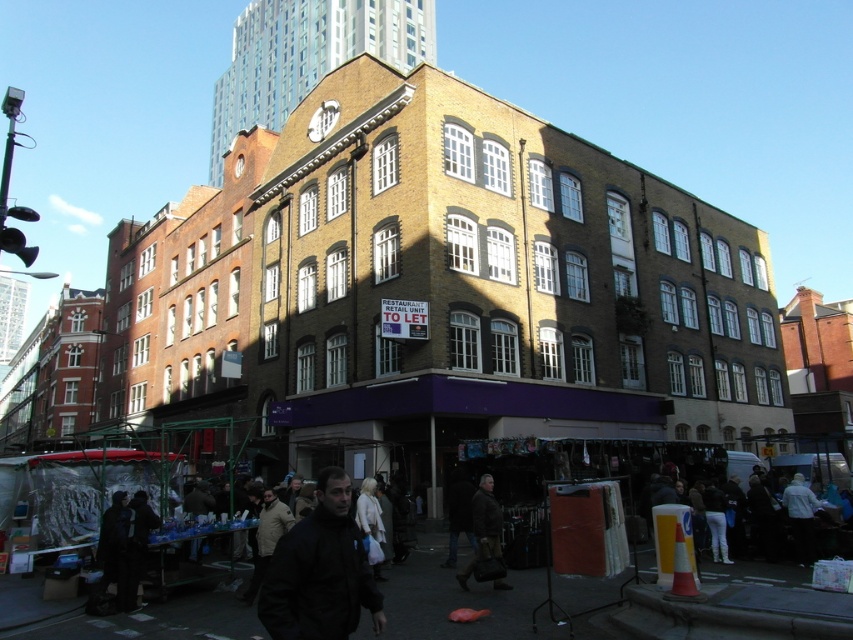
You are a delivery person standing at the edge of the market. You need to pick up two items, the brown leather jacket at center and the white fabric coat at center. How far apart are these two items from each other?

The brown leather jacket at center is 17.45 feet away from the white fabric coat at center.

You are a customer shopping for outerwear in the market stalls. You see a brown leather jacket at center and a white fabric coat at center. Which one is more likely to be a thinner item?

The brown leather jacket at center is thinner than the white fabric coat at center, so the brown leather jacket at center is more likely to be a thinner item.

You are a customer looking to buy a jacket. You see a black matte jacket at lower center and a brown leather jacket at center. Which jacket is wider?

Result: The black matte jacket at lower center is wider than the brown leather jacket at center.